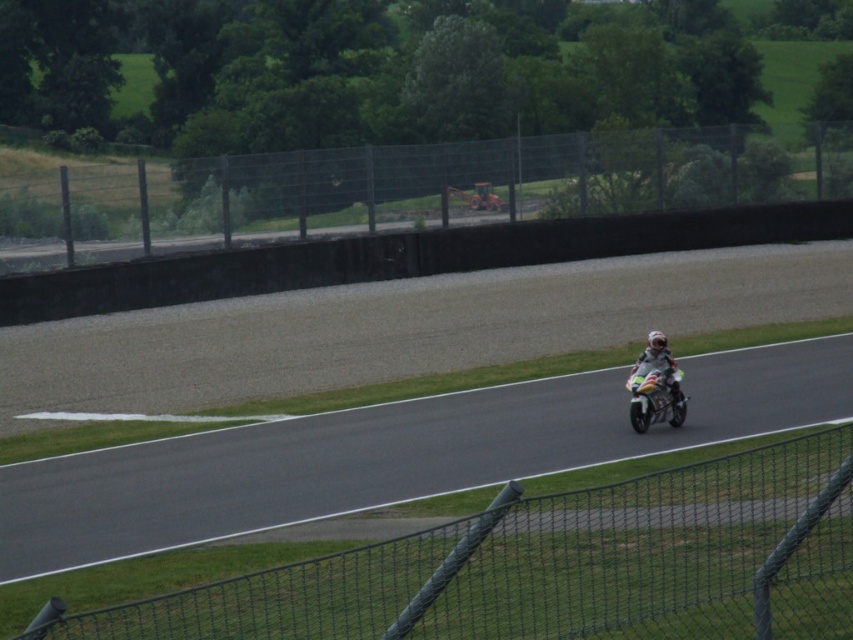
Find the location of `metallic wire mesh fence at upper center`. metallic wire mesh fence at upper center is located at coordinates (409, 188).

Is metallic wire mesh fence at upper center taller than shiny silver motorcycle at center?

Yes, metallic wire mesh fence at upper center is taller than shiny silver motorcycle at center.

At what (x,y) coordinates should I click in order to perform the action: click on metallic wire mesh fence at upper center. Please return your answer as a coordinate pair (x, y). The width and height of the screenshot is (853, 640). Looking at the image, I should click on (409, 188).

The image size is (853, 640). I want to click on metallic wire mesh fence at upper center, so click(409, 188).

Between point (538, 522) and point (645, 408), which one is positioned behind?

Positioned behind is point (645, 408).

Find the location of a particular element. The height and width of the screenshot is (640, 853). black mesh fence at lower right is located at coordinates (527, 564).

Locate an element on the screen. The height and width of the screenshot is (640, 853). black mesh fence at lower right is located at coordinates (527, 564).

Can you confirm if black mesh fence at lower right is positioned to the left of metallic wire mesh fence at upper center?

No, black mesh fence at lower right is not to the left of metallic wire mesh fence at upper center.

Which of these two, black mesh fence at lower right or metallic wire mesh fence at upper center, stands taller?

metallic wire mesh fence at upper center

Does point (755, 531) come closer to viewer compared to point (589, 150)?

Yes, it is.

The width and height of the screenshot is (853, 640). Find the location of `black mesh fence at lower right`. black mesh fence at lower right is located at coordinates (527, 564).